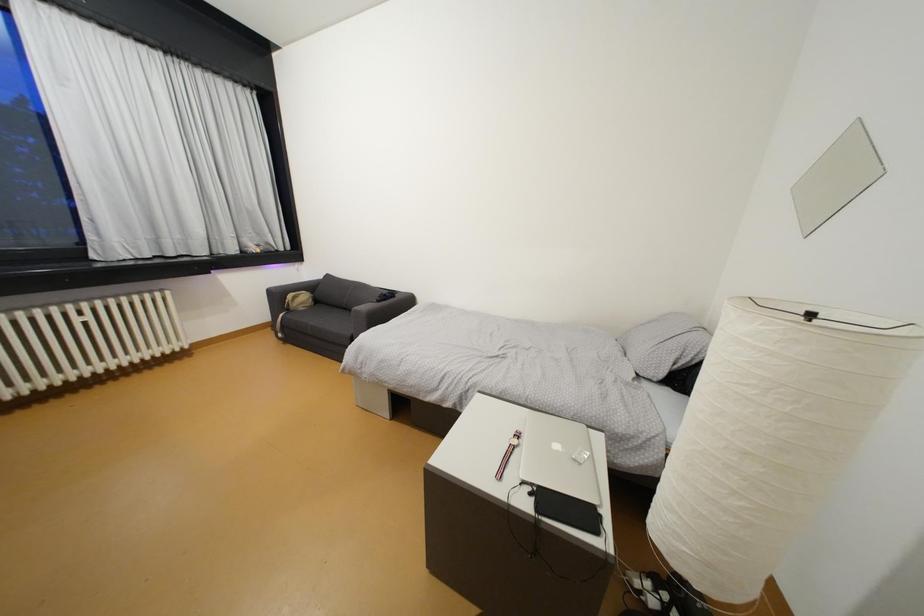
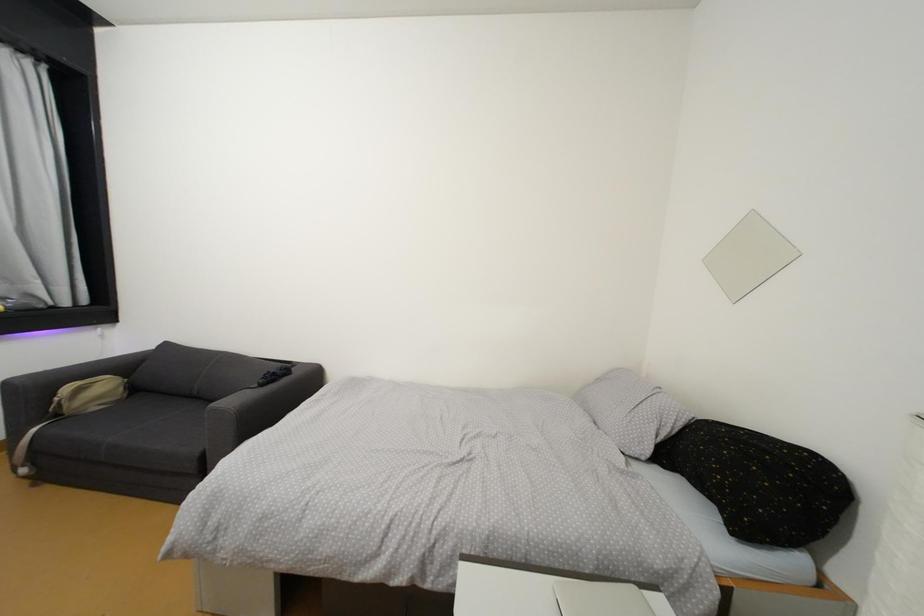
Question: The images are taken continuously from a first-person perspective. In which direction is your viewpoint rotating?

Choices:
 (A) Left
 (B) Right
 (C) Up
 (D) Down

Answer: (B)